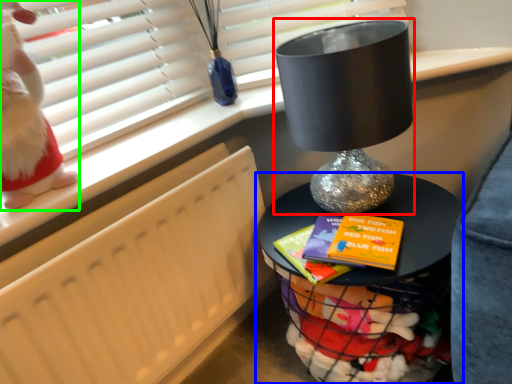
Question: Which object is the farthest from table lamp (highlighted by a red box)? Choose among these: furniture (highlighted by a blue box) or doll (highlighted by a green box).

Choices:
 (A) furniture
 (B) doll

Answer: (B)